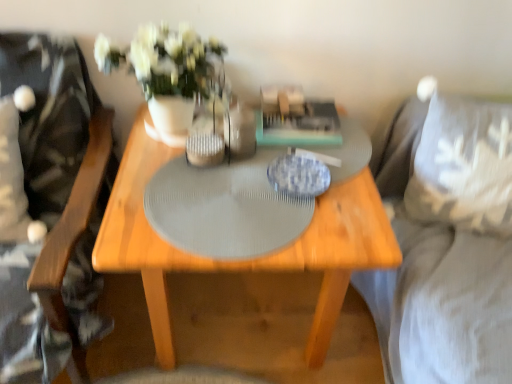
Image resolution: width=512 pixels, height=384 pixels. What are the coordinates of `wooden swivel chair at left` in the screenshot? It's located at (49, 116).

Measure the distance between point (174, 231) and camera.

Point (174, 231) and camera are 33.66 inches apart.

Describe the element at coordinates (243, 261) in the screenshot. The image size is (512, 384). I see `wooden table at center` at that location.

Image resolution: width=512 pixels, height=384 pixels. Identify the location of white ceramic vase at center. (170, 119).

In order to face white ceramic vase at center, should I rotate leftwards or rightwards?

To face it directly, rotate left by 8.882 degrees.

The width and height of the screenshot is (512, 384). What do you see at coordinates (445, 241) in the screenshot?
I see `suede gray couch at right` at bounding box center [445, 241].

Find the location of `wooden swivel chair at left`. wooden swivel chair at left is located at coordinates [49, 116].

Based on the photo, from the image's perspective, which object appears higher, wooden table at center or wooden swivel chair at left?

wooden swivel chair at left.

Considering the sizes of objects wooden table at center and wooden swivel chair at left in the image provided, who is shorter, wooden table at center or wooden swivel chair at left?

With less height is wooden table at center.

Is wooden table at center facing away from wooden swivel chair at left?

That's not correct — wooden table at center is not looking away from wooden swivel chair at left.

Is wooden table at center wider than wooden swivel chair at left?

No.

In order to click on glass table behind the suede gray couch at right in this screenshot , I will do `click(223, 210)`.

From the image's perspective, is gray textured placemat at center positioned above or below suede gray couch at right?

gray textured placemat at center is situated higher than suede gray couch at right in the image.

Based on the photo, does gray textured placemat at center turn towards suede gray couch at right?

No, gray textured placemat at center does not turn towards suede gray couch at right.

Is suede gray couch at right beside white ceramic vase at center?

No, suede gray couch at right is not next to white ceramic vase at center.

From a real-world perspective, is suede gray couch at right above or below white ceramic vase at center?

In terms of real-world spatial position, suede gray couch at right is below white ceramic vase at center.

Which is in front, point (420, 218) or point (166, 105)?

The point (166, 105) is in front.

Locate an element on the screen. This screenshot has width=512, height=384. couch located in front of the white ceramic vase at center is located at coordinates (445, 241).

Is white ceramic vase at center facing away from gray textured placemat at center?

No, white ceramic vase at center is not facing away from gray textured placemat at center.

Where is `vase behind the gray textured placemat at center`? This screenshot has width=512, height=384. vase behind the gray textured placemat at center is located at coordinates (170, 119).

Considering their positions, is white ceramic vase at center located in front of or behind gray textured placemat at center?

white ceramic vase at center is positioned farther from the viewer than gray textured placemat at center.

Are white ceramic vase at center and gray textured placemat at center making contact?

white ceramic vase at center and gray textured placemat at center are not in contact.

Is wooden table at center closer to the viewer compared to white ceramic vase at center?

Yes, wooden table at center is closer to the viewer.

Between wooden table at center and white ceramic vase at center, which one has larger width?

wooden table at center is wider.

From a real-world perspective, between wooden table at center and white ceramic vase at center, who is vertically lower?

wooden table at center is physically lower.

From the image's perspective, is wooden table at center positioned above or below white ceramic vase at center?

From the image's perspective, wooden table at center appears below white ceramic vase at center.

Identify the location of vase behind the wooden table at center. (170, 119).

Which object is positioned more to the right, white ceramic vase at center or wooden table at center?

Positioned to the right is wooden table at center.

Which object is closer to the camera taking this photo, white ceramic vase at center or wooden table at center?

wooden table at center.

Looking at this image, is white fabric pillow at right taller or shorter than gray textured placemat at center?

Clearly, white fabric pillow at right is taller compared to gray textured placemat at center.

How many degrees apart are the facing directions of white fabric pillow at right and gray textured placemat at center?

20.5 degrees separate the facing orientations of white fabric pillow at right and gray textured placemat at center.

From a real-world perspective, is white fabric pillow at right positioned above or below gray textured placemat at center?

white fabric pillow at right is situated lower than gray textured placemat at center in the real world.

Is white fabric pillow at right at the left side of gray textured placemat at center?

In fact, white fabric pillow at right is to the right of gray textured placemat at center.

Where is `swivel chair on the left of the wooden table at center`? The width and height of the screenshot is (512, 384). swivel chair on the left of the wooden table at center is located at coordinates (49, 116).

In the image, there is a gray textured placemat at center. Where is `couch below it (from the image's perspective)`? This screenshot has height=384, width=512. couch below it (from the image's perspective) is located at coordinates (445, 241).

In the scene shown: Considering their positions, is white ceramic vase at center positioned closer to white fabric pillow at right than wooden swivel chair at left?

white ceramic vase at center lies closer to white fabric pillow at right than the other object.

Estimate the real-world distances between objects in this image. Which object is closer to wooden table at center, wooden swivel chair at left or suede gray couch at right?

Based on the image, wooden swivel chair at left appears to be nearer to wooden table at center.

Estimate the real-world distances between objects in this image. Which object is closer to gray textured placemat at center, white ceramic vase at center or wooden table at center?

wooden table at center is positioned closer to the anchor gray textured placemat at center.

From the image, which object appears to be nearer to wooden swivel chair at left, white fabric pillow at right or white ceramic vase at center?

Among the two, white ceramic vase at center is located nearer to wooden swivel chair at left.

Looking at the image, which one is located closer to white fabric pillow at right, white ceramic vase at center or suede gray couch at right?

suede gray couch at right lies closer to white fabric pillow at right than the other object.

Looking at the image, which one is located further to wooden swivel chair at left, gray textured placemat at center or white ceramic vase at center?

gray textured placemat at center.

Based on the photo, looking at the image, which one is located further to suede gray couch at right, wooden swivel chair at left or wooden table at center?

Based on the image, wooden swivel chair at left appears to be further to suede gray couch at right.

Based on their spatial positions, is gray textured placemat at center or wooden swivel chair at left further from suede gray couch at right?

wooden swivel chair at left is positioned further to the anchor suede gray couch at right.

Find the location of a particular element. table between white ceramic vase at center and white fabric pillow at right from left to right is located at coordinates (243, 261).

Identify the location of vase located between wooden swivel chair at left and gray textured placemat at center in the left-right direction. click(170, 119).

Find the location of a particular element. The height and width of the screenshot is (384, 512). pillow between white ceramic vase at center and suede gray couch at right is located at coordinates (464, 166).

Where is `glass table between wooden swivel chair at left and suede gray couch at right`? glass table between wooden swivel chair at left and suede gray couch at right is located at coordinates (223, 210).